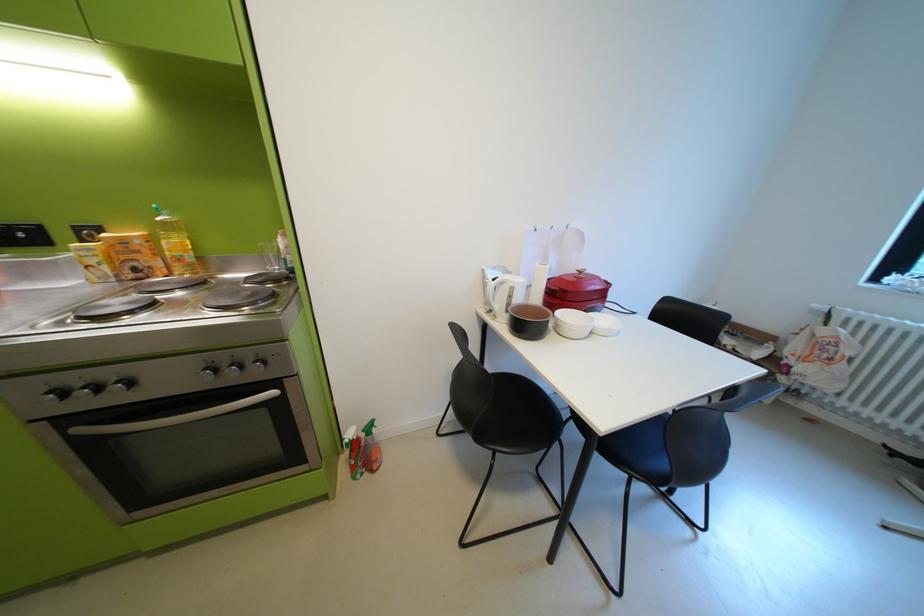
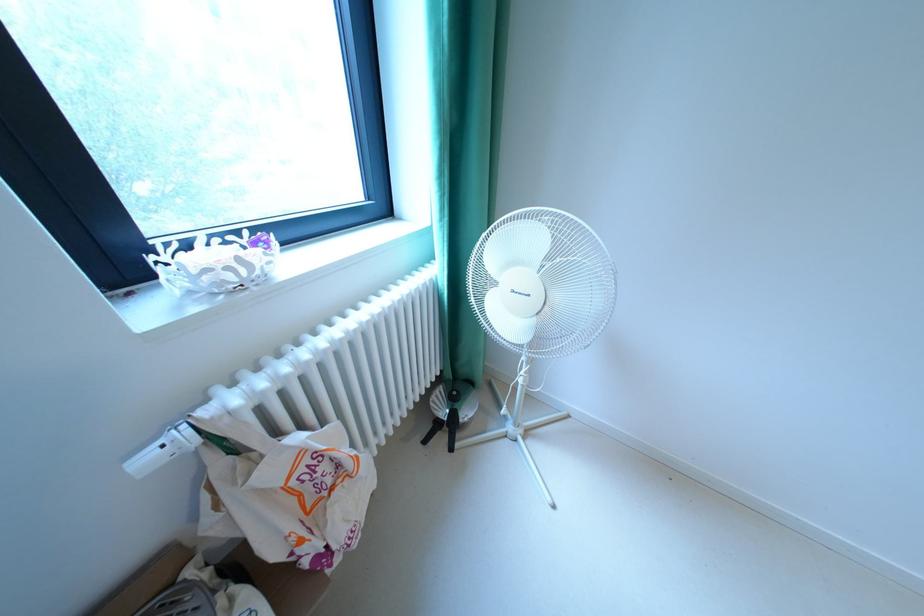
Locate, in the second image, the point that corresponds to (825,306) in the first image.

(156, 460)